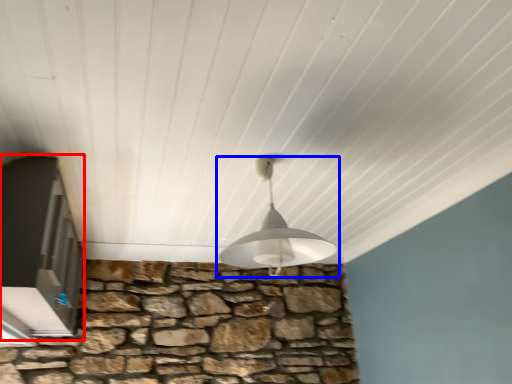
Question: Which object appears closest to the camera in this image, window (highlighted by a red box) or lamp (highlighted by a blue box)?

Choices:
 (A) window
 (B) lamp

Answer: (B)